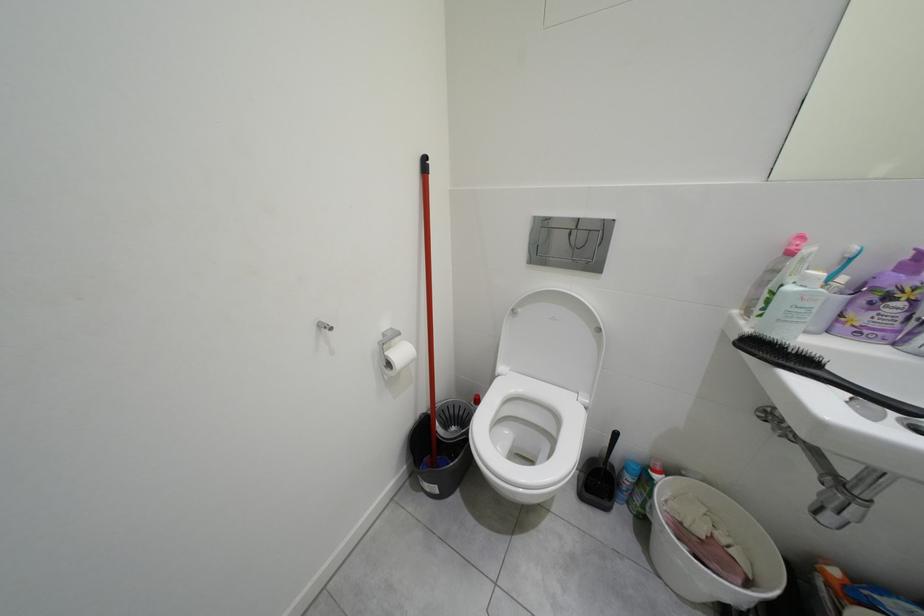
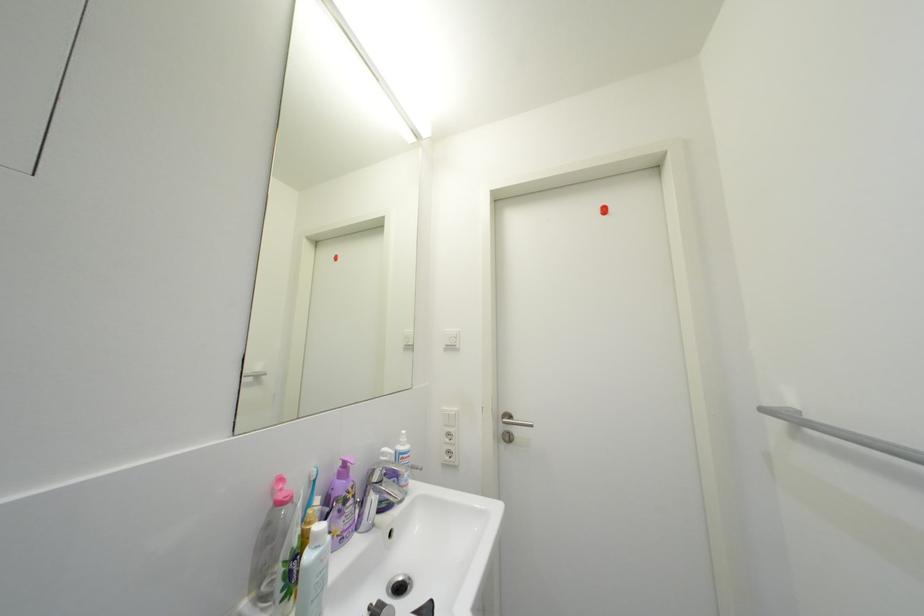
Question: The camera is either moving clockwise (left) or counter-clockwise (right) around the object. The first image is from the beginning of the video and the second image is from the end. Is the camera moving left or right when shooting the video?

Choices:
 (A) Left
 (B) Right

Answer: (A)